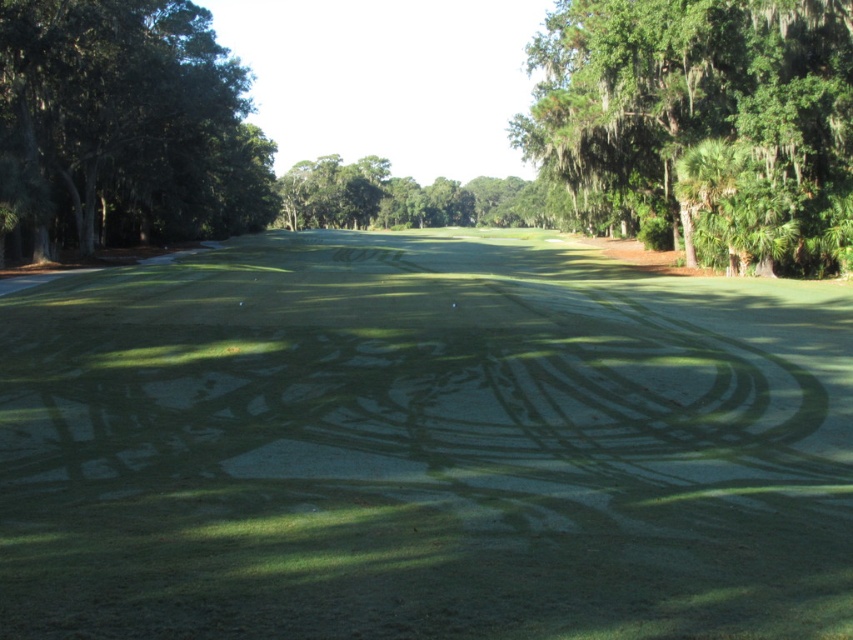
Between green smooth turf at center and green leafy tree at left, which one appears on the right side from the viewer's perspective?

green smooth turf at center

Is point (773, 596) behind point (74, 6)?

No, it is not.

What do you see at coordinates (422, 445) in the screenshot?
I see `green smooth turf at center` at bounding box center [422, 445].

Identify the location of green smooth turf at center. The width and height of the screenshot is (853, 640). (422, 445).

Does green smooth turf at center appear over green leafy tree at upper right?

No.

Can you confirm if green smooth turf at center is shorter than green leafy tree at upper right?

Yes.

Is point (107, 577) more distant than point (543, 122)?

That is False.

Locate an element on the screen. This screenshot has width=853, height=640. green smooth turf at center is located at coordinates (422, 445).

Between green leafy tree at upper right and green leafy tree at left, which one appears on the left side from the viewer's perspective?

From the viewer's perspective, green leafy tree at left appears more on the left side.

I want to click on green leafy tree at upper right, so click(x=701, y=122).

Between point (769, 125) and point (154, 156), which one is positioned behind?

The point (154, 156) is more distant.

Where is `green leafy tree at upper right`? Image resolution: width=853 pixels, height=640 pixels. green leafy tree at upper right is located at coordinates (701, 122).